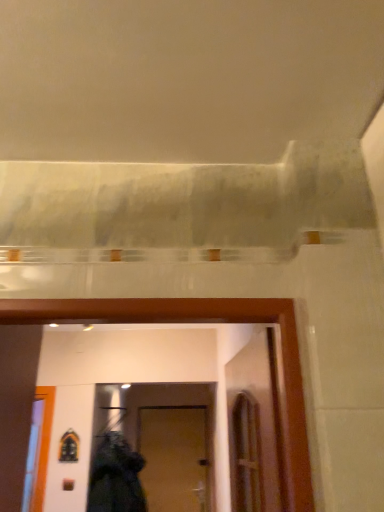
Question: From their relative heights in the image, would you say black fabric at lower center is taller or shorter than wooden door at center?

Choices:
 (A) tall
 (B) short

Answer: (B)

Question: From the image's perspective, is black fabric at lower center above or below wooden door at center?

Choices:
 (A) below
 (B) above

Answer: (B)

Question: Is black fabric at lower center bigger or smaller than wooden door at center?

Choices:
 (A) big
 (B) small

Answer: (A)

Question: Considering the positions of wooden door at center and black fabric at lower center in the image, is wooden door at center bigger or smaller than black fabric at lower center?

Choices:
 (A) small
 (B) big

Answer: (A)

Question: In terms of height, does wooden door at center look taller or shorter compared to black fabric at lower center?

Choices:
 (A) short
 (B) tall

Answer: (B)

Question: Considering their positions, is wooden door at center located in front of or behind black fabric at lower center?

Choices:
 (A) behind
 (B) front

Answer: (A)

Question: Visually, is wooden door at center positioned to the left or to the right of black fabric at lower center?

Choices:
 (A) right
 (B) left

Answer: (A)